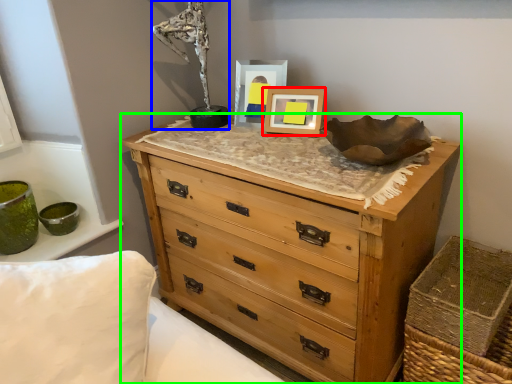
Question: Which is farther away from picture frame (highlighted by a red box)? antique (highlighted by a blue box) or chest of drawers (highlighted by a green box)?

Choices:
 (A) antique
 (B) chest of drawers

Answer: (B)